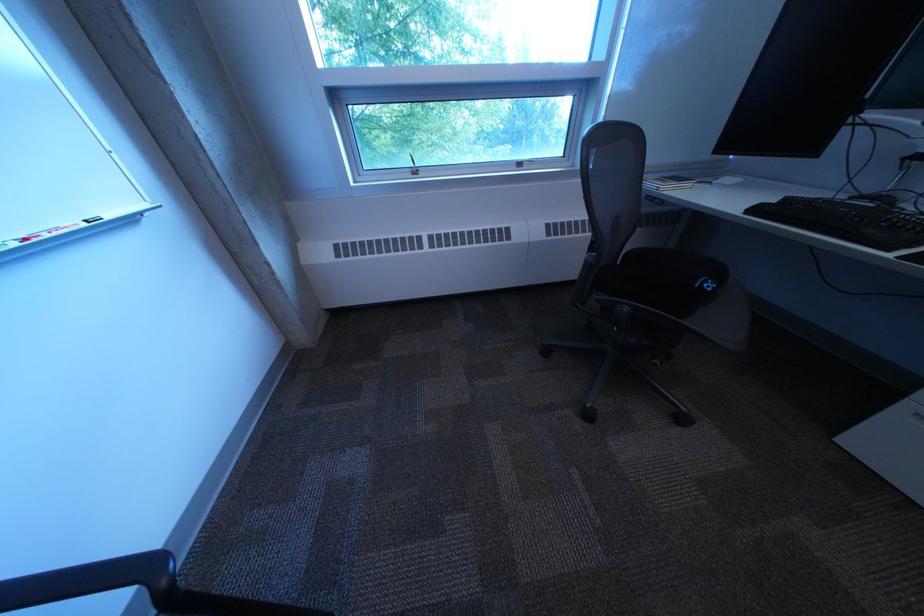
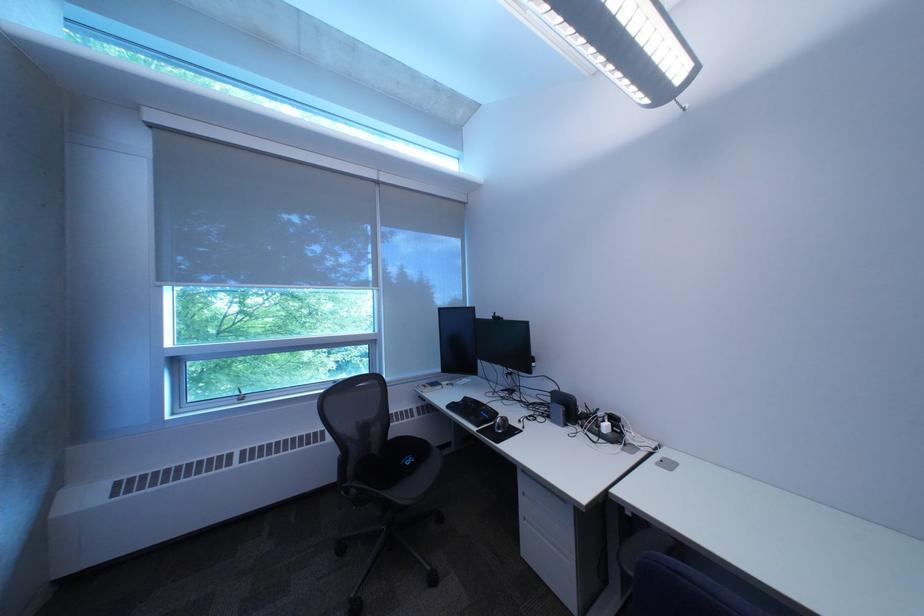
Find the pixel in the second image that matches [722,284] in the first image.

(423, 461)